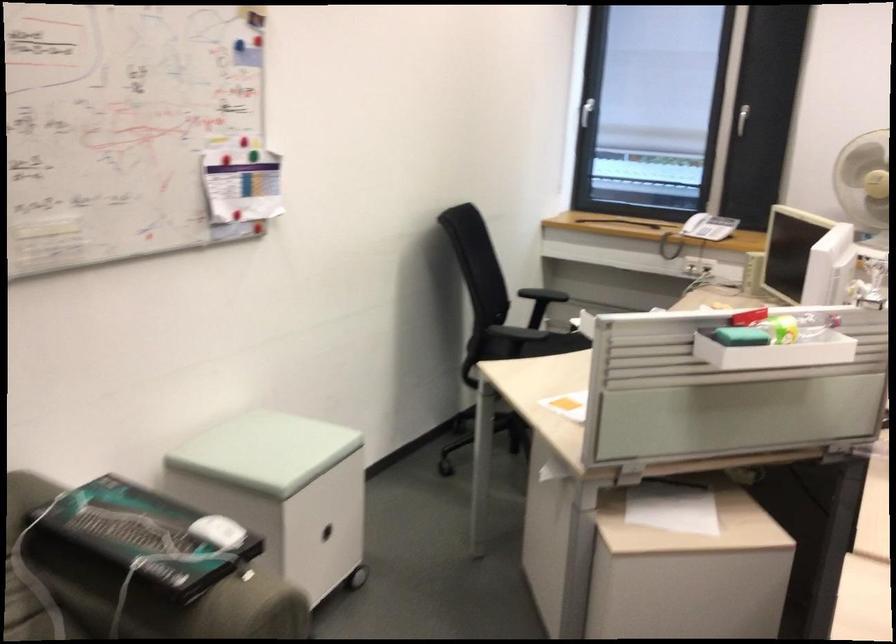
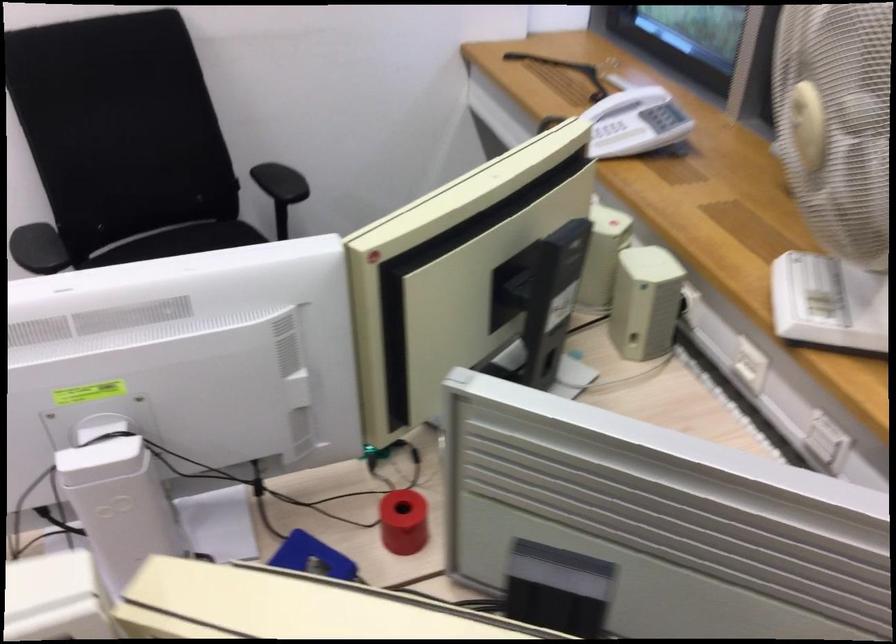
In the second image, find the point that corresponds to point (713, 221) in the first image.

(634, 122)